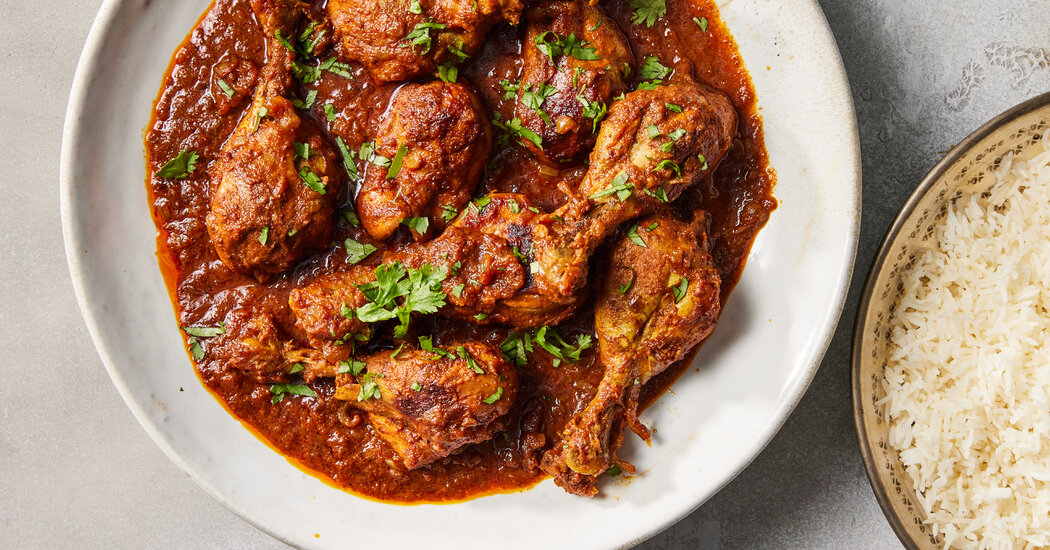
This screenshot has height=550, width=1050. I want to click on white surface, so click(43, 475).